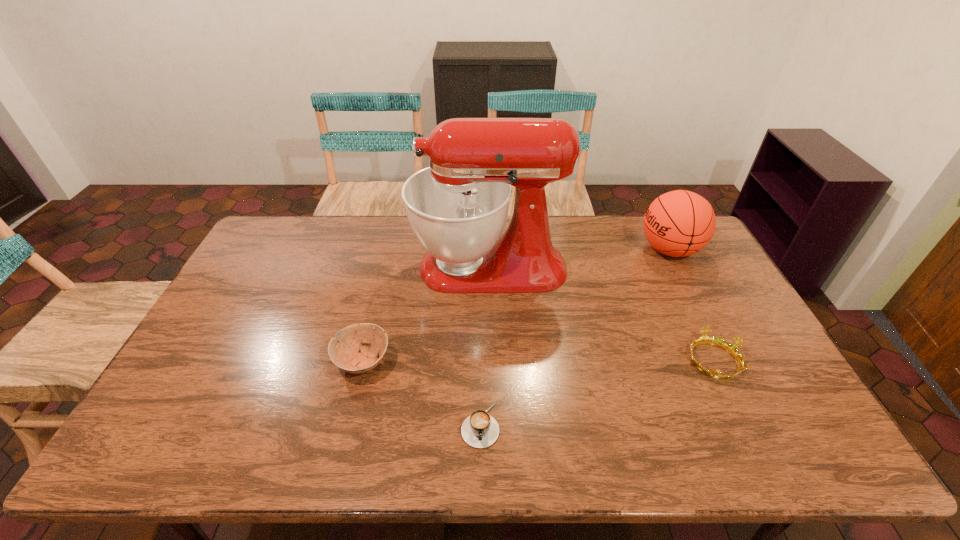
Where is `mixer`? The height and width of the screenshot is (540, 960). mixer is located at coordinates (457, 207).

Image resolution: width=960 pixels, height=540 pixels. I want to click on the fourth shortest object, so click(x=679, y=223).

Where is `bowl`? Image resolution: width=960 pixels, height=540 pixels. bowl is located at coordinates (346, 356).

Locate an element on the screen. This screenshot has height=540, width=960. the third shortest object is located at coordinates (346, 356).

Identify the location of crown. The height and width of the screenshot is (540, 960). (704, 339).

The image size is (960, 540). In order to click on the nearest object in this screenshot , I will do `click(480, 430)`.

Where is `free region located 0.050m at the attachment hub of the mixer`? free region located 0.050m at the attachment hub of the mixer is located at coordinates (397, 267).

Identify the location of vacant space situated 0.170m at the attachment hub of the mixer. The height and width of the screenshot is (540, 960). (362, 267).

You are a GUI agent. You are given a task and a screenshot of the screen. Output one action in this format:
    pyautogui.click(x=<x>, y=<y>)
    Task: Click on the vacant region located at the attachment hub of the mixer
    
    Given the screenshot: What is the action you would take?
    pyautogui.click(x=321, y=267)

The width and height of the screenshot is (960, 540). What are the coordinates of `vacant space located on the side with logo of the second tallest object` in the screenshot? It's located at (592, 250).